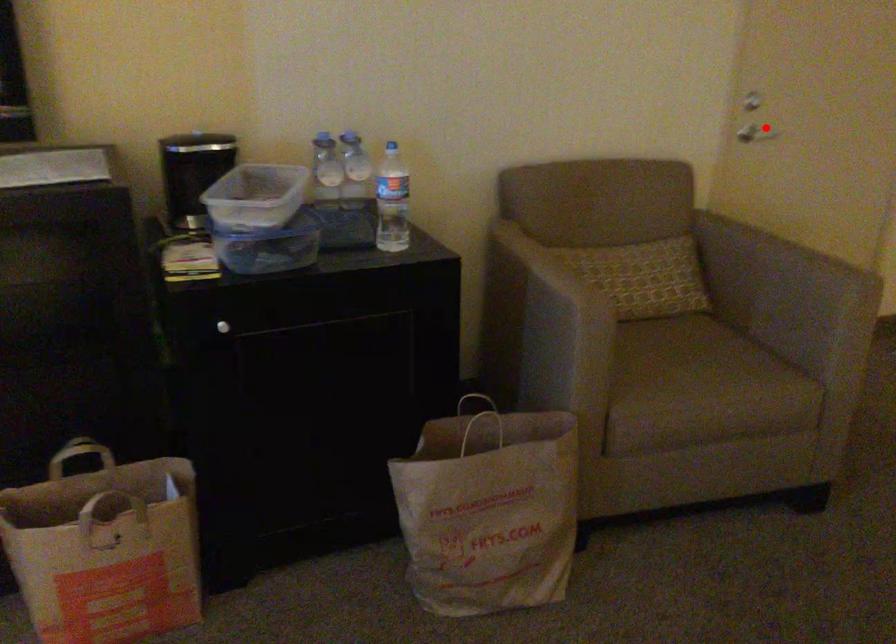
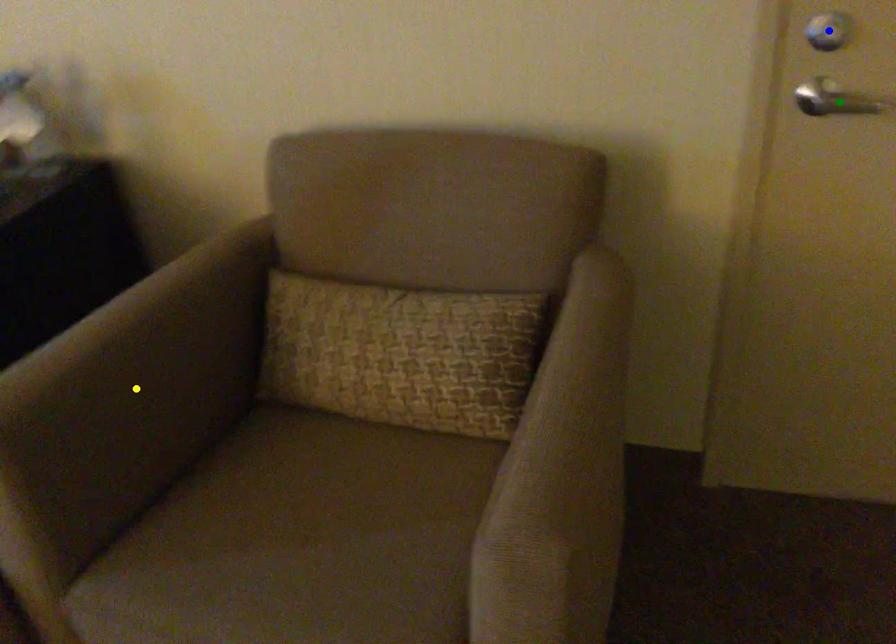
Question: I am providing you with two images of the same scene from different viewpoints. A red point is marked on the first image. You are given multiple points on the second image. Which spot in image 2 lines up with the point in image 1?

Choices:
 (A) blue point
 (B) green point
 (C) yellow point

Answer: (B)